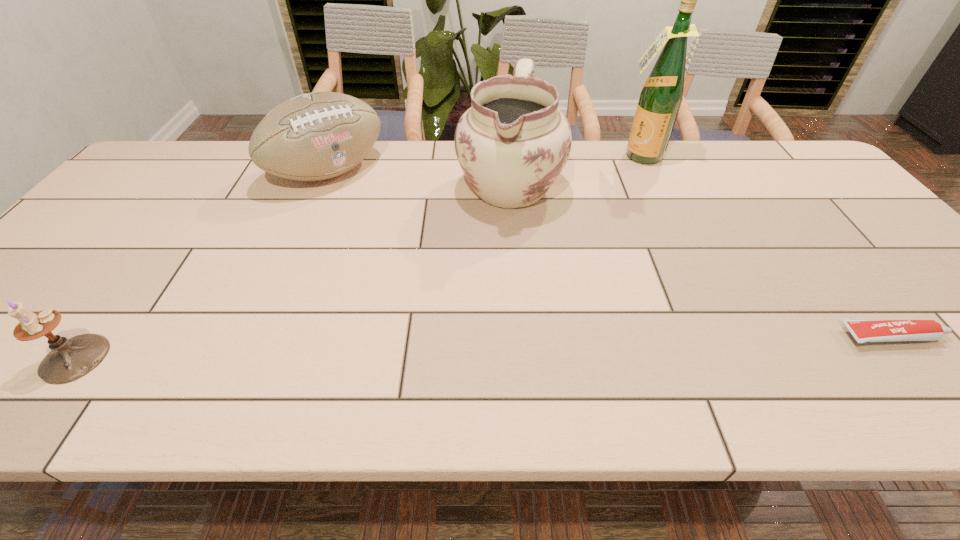
This screenshot has width=960, height=540. What are the coordinates of `free space located 0.260m on the back of the fourth tallest object` in the screenshot? It's located at (156, 250).

Find the location of a particular element. This screenshot has height=540, width=960. free region located on the spout of the third object from left to right is located at coordinates (475, 255).

Where is `free location located 0.340m on the spout of the third object from left to right`? The height and width of the screenshot is (540, 960). free location located 0.340m on the spout of the third object from left to right is located at coordinates (441, 317).

Locate an element on the screen. The height and width of the screenshot is (540, 960). vacant space situated 0.260m on the spout of the third object from left to right is located at coordinates (455, 292).

Identify the location of vacant region located on the front-facing side of the fourth object from left to right. coord(597,226).

This screenshot has height=540, width=960. Identify the location of vacant area located on the front-facing side of the fourth object from left to right. (627, 174).

This screenshot has height=540, width=960. What are the coordinates of `vacant space located 0.240m on the front-facing side of the fourth object from left to right` in the screenshot? It's located at (609, 206).

Image resolution: width=960 pixels, height=540 pixels. I want to click on free space located on the laces of the third tallest object, so click(371, 206).

The width and height of the screenshot is (960, 540). In order to click on vacant area situated 0.190m on the laces of the third tallest object in this screenshot , I will do `click(392, 226)`.

This screenshot has height=540, width=960. What are the coordinates of `vacant space located 0.220m on the laces of the third tallest object` in the screenshot? It's located at (398, 231).